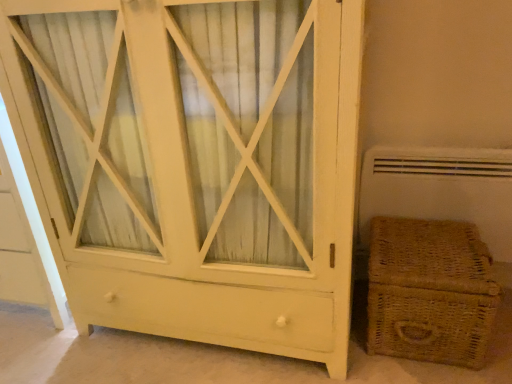
Question: Are braided wicker basket at lower right and white wood cabinet at center far apart?

Choices:
 (A) yes
 (B) no

Answer: (B)

Question: Can you confirm if braided wicker basket at lower right is wider than white wood cabinet at center?

Choices:
 (A) yes
 (B) no

Answer: (B)

Question: Is braided wicker basket at lower right facing away from white wood cabinet at center?

Choices:
 (A) no
 (B) yes

Answer: (A)

Question: From a real-world perspective, is braided wicker basket at lower right physically above white wood cabinet at center?

Choices:
 (A) yes
 (B) no

Answer: (B)

Question: Is braided wicker basket at lower right bigger than white wood cabinet at center?

Choices:
 (A) yes
 (B) no

Answer: (B)

Question: Considering the relative sizes of braided wicker basket at lower right and white wood cabinet at center in the image provided, is braided wicker basket at lower right thinner than white wood cabinet at center?

Choices:
 (A) no
 (B) yes

Answer: (B)

Question: Considering the relative sizes of white wood cabinet at center and braided wicker basket at lower right in the image provided, is white wood cabinet at center bigger than braided wicker basket at lower right?

Choices:
 (A) no
 (B) yes

Answer: (B)

Question: From the image's perspective, does white wood cabinet at center appear lower than braided wicker basket at lower right?

Choices:
 (A) yes
 (B) no

Answer: (B)

Question: Can you confirm if white wood cabinet at center is smaller than braided wicker basket at lower right?

Choices:
 (A) no
 (B) yes

Answer: (A)

Question: Is white wood cabinet at center oriented towards braided wicker basket at lower right?

Choices:
 (A) no
 (B) yes

Answer: (A)

Question: Is white wood cabinet at center positioned in front of braided wicker basket at lower right?

Choices:
 (A) no
 (B) yes

Answer: (B)

Question: Is white wood cabinet at center to the right of braided wicker basket at lower right from the viewer's perspective?

Choices:
 (A) yes
 (B) no

Answer: (B)

Question: Based on their positions, is braided wicker basket at lower right located to the left or right of white wood cabinet at center?

Choices:
 (A) right
 (B) left

Answer: (A)